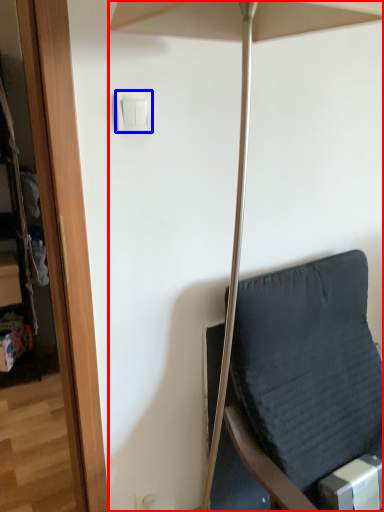
Question: Which point is closer to the camera, umbrella (highlighted by a red box) or light switch (highlighted by a blue box)?

Choices:
 (A) umbrella
 (B) light switch

Answer: (A)